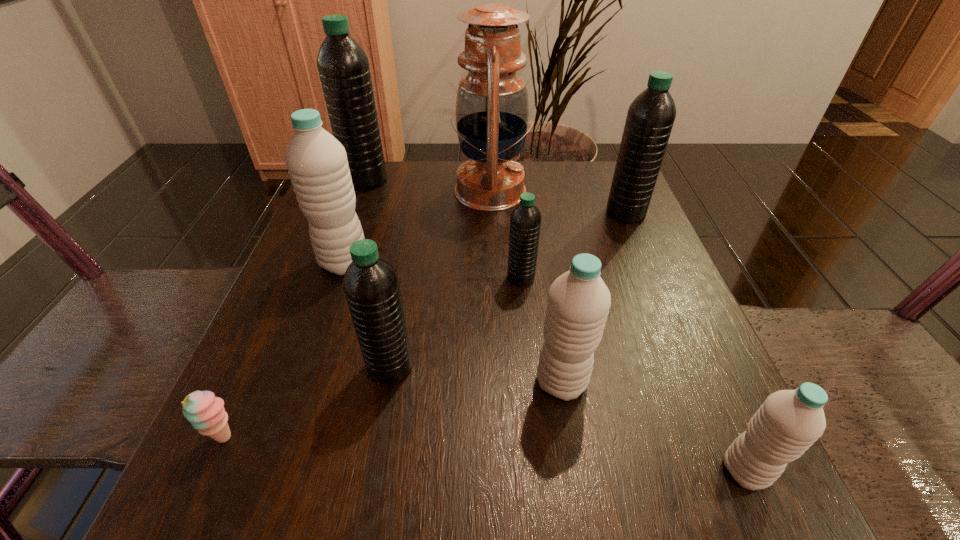
Locate an element on the screen. Image resolution: width=960 pixels, height=540 pixels. the second nearest white water bottle is located at coordinates (578, 304).

This screenshot has width=960, height=540. Identify the location of the smallest black water bottle. (525, 221).

The image size is (960, 540). In order to click on the third black water bottle from left to right in this screenshot , I will do `click(525, 221)`.

In order to click on the nearest water bottle in this screenshot , I will do `click(789, 421)`.

The height and width of the screenshot is (540, 960). I want to click on the nearest white water bottle, so click(789, 421).

Find the location of a particular element. sherbert is located at coordinates (206, 413).

I want to click on vacant space located on the front of the blue oil lamp, so click(x=493, y=295).

Identify the location of free point located on the right of the tallest water bottle. (495, 180).

Where is `free space located 0.220m on the right of the farthest white water bottle`? The width and height of the screenshot is (960, 540). free space located 0.220m on the right of the farthest white water bottle is located at coordinates (481, 262).

The width and height of the screenshot is (960, 540). Identify the location of vacant space located 0.160m on the back of the second biggest black water bottle. (607, 167).